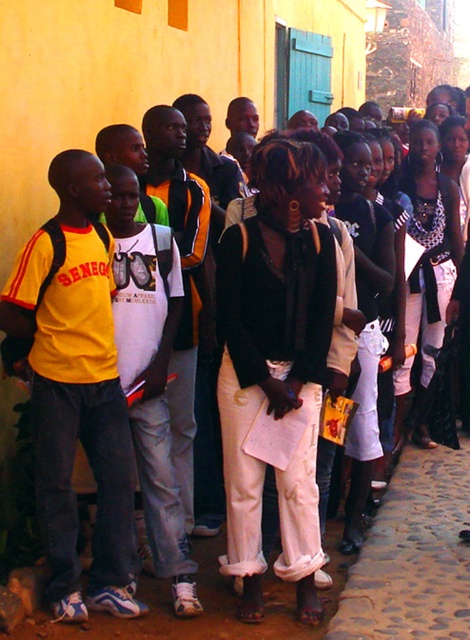
How far apart are matte black sweater at center and yellow matte shirt at left?

A distance of 34.98 inches exists between matte black sweater at center and yellow matte shirt at left.

Who is shorter, matte black sweater at center or yellow matte shirt at left?

With less height is yellow matte shirt at left.

Which is behind, point (250, 397) or point (40, 440)?

Point (250, 397)

Find the location of a particular element. The width and height of the screenshot is (470, 640). matte black sweater at center is located at coordinates (275, 364).